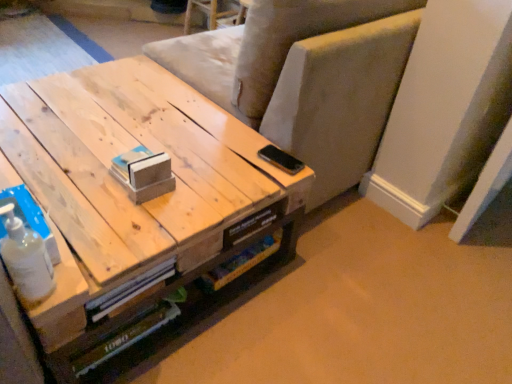
Question: Is natural wood table at center closer to the viewer compared to light beige fabric armchair at upper center?

Choices:
 (A) yes
 (B) no

Answer: (A)

Question: Is natural wood table at center at the right side of light beige fabric armchair at upper center?

Choices:
 (A) yes
 (B) no

Answer: (B)

Question: Considering the relative sizes of natural wood table at center and light beige fabric armchair at upper center in the image provided, is natural wood table at center taller than light beige fabric armchair at upper center?

Choices:
 (A) yes
 (B) no

Answer: (B)

Question: Is natural wood table at center further to camera compared to light beige fabric armchair at upper center?

Choices:
 (A) yes
 (B) no

Answer: (B)

Question: Does natural wood table at center have a lesser height compared to light beige fabric armchair at upper center?

Choices:
 (A) no
 (B) yes

Answer: (B)

Question: Would you say light beige fabric armchair at upper center is to the left or to the right of natural wood table at center in the picture?

Choices:
 (A) right
 (B) left

Answer: (A)

Question: In terms of height, does light beige fabric armchair at upper center look taller or shorter compared to natural wood table at center?

Choices:
 (A) tall
 (B) short

Answer: (A)

Question: In terms of size, does light beige fabric armchair at upper center appear bigger or smaller than natural wood table at center?

Choices:
 (A) small
 (B) big

Answer: (B)

Question: Does point (348, 41) appear closer or farther from the camera than point (3, 87)?

Choices:
 (A) farther
 (B) closer

Answer: (B)

Question: Relative to natural wood table at center, is white matte bottle at lower left in front or behind?

Choices:
 (A) behind
 (B) front

Answer: (B)

Question: From the image's perspective, is white matte bottle at lower left positioned above or below natural wood table at center?

Choices:
 (A) below
 (B) above

Answer: (A)

Question: Do you think white matte bottle at lower left is within natural wood table at center, or outside of it?

Choices:
 (A) outside
 (B) inside

Answer: (A)

Question: Would you say white matte bottle at lower left is to the left or to the right of natural wood table at center in the picture?

Choices:
 (A) right
 (B) left

Answer: (A)

Question: In the image, is natural wood table at center on the left side or the right side of light beige fabric armchair at upper center?

Choices:
 (A) right
 (B) left

Answer: (B)

Question: From the image's perspective, is natural wood table at center located above or below light beige fabric armchair at upper center?

Choices:
 (A) above
 (B) below

Answer: (B)